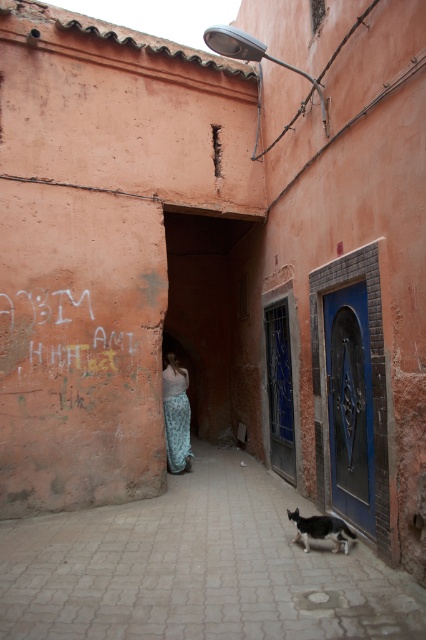
Does patterned fabric dress at center have a lesser width compared to black and white fur cat at lower right?

Correct, patterned fabric dress at center's width is less than black and white fur cat at lower right's.

What do you see at coordinates (176, 416) in the screenshot? The image size is (426, 640). I see `patterned fabric dress at center` at bounding box center [176, 416].

The height and width of the screenshot is (640, 426). I want to click on patterned fabric dress at center, so click(x=176, y=416).

Is smooth stone alley at center taller than patterned fabric dress at center?

Incorrect, smooth stone alley at center's height is not larger of patterned fabric dress at center's.

The height and width of the screenshot is (640, 426). What do you see at coordinates (198, 566) in the screenshot?
I see `smooth stone alley at center` at bounding box center [198, 566].

Which is behind, point (224, 625) or point (187, 404)?

The point (187, 404) is behind.

Find the location of a particular element. This screenshot has height=640, width=426. smooth stone alley at center is located at coordinates (198, 566).

This screenshot has width=426, height=640. I want to click on smooth stone alley at center, so click(x=198, y=566).

Can you confirm if smooth stone alley at center is positioned to the left of black and white fur cat at lower right?

Correct, you'll find smooth stone alley at center to the left of black and white fur cat at lower right.

Does point (0, 596) lie in front of point (344, 525)?

Yes, point (0, 596) is in front of point (344, 525).

Where is `smooth stone alley at center`? This screenshot has height=640, width=426. smooth stone alley at center is located at coordinates 198,566.